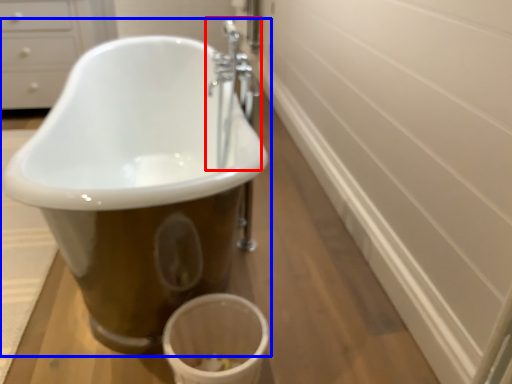
Question: Which point is closer to the camera, tap (highlighted by a red box) or bathtub (highlighted by a blue box)?

Choices:
 (A) tap
 (B) bathtub

Answer: (B)